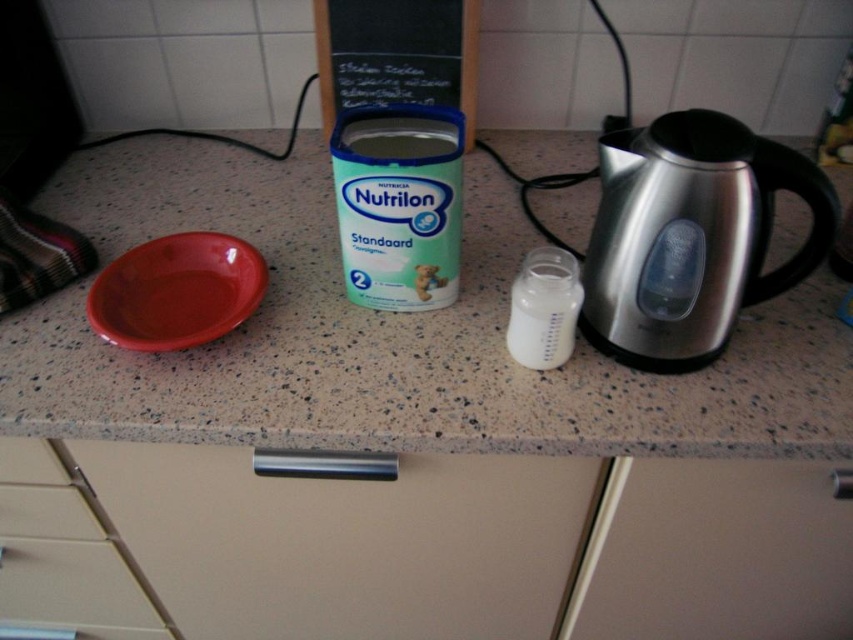
What are the coordinates of `white matte canister at center` in the screenshot? It's located at (399, 204).

Between white matte canister at center and translucent plastic bottle at center, which one is positioned higher?

white matte canister at center

The width and height of the screenshot is (853, 640). Describe the element at coordinates (399, 204) in the screenshot. I see `white matte canister at center` at that location.

Find the location of a particular element. This screenshot has width=853, height=640. white matte canister at center is located at coordinates (399, 204).

Can you confirm if satin silver kettle at right is wider than translucent plastic bottle at center?

Indeed, satin silver kettle at right has a greater width compared to translucent plastic bottle at center.

Does satin silver kettle at right have a larger size compared to translucent plastic bottle at center?

Correct, satin silver kettle at right is larger in size than translucent plastic bottle at center.

The height and width of the screenshot is (640, 853). Describe the element at coordinates (691, 236) in the screenshot. I see `satin silver kettle at right` at that location.

The height and width of the screenshot is (640, 853). What are the coordinates of `satin silver kettle at right` in the screenshot? It's located at (691, 236).

Between white matte canister at center and matte plastic bowl at left, which one appears on the right side from the viewer's perspective?

white matte canister at center is more to the right.

Between point (364, 108) and point (206, 250), which one is positioned behind?

Positioned behind is point (206, 250).

Is point (352, 244) farther from camera compared to point (189, 340)?

That is True.

You are a GUI agent. You are given a task and a screenshot of the screen. Output one action in this format:
    pyautogui.click(x=<x>, y=<y>)
    Task: Click on the white matte canister at center
    The image size is (853, 640).
    Given the screenshot: What is the action you would take?
    pyautogui.click(x=399, y=204)